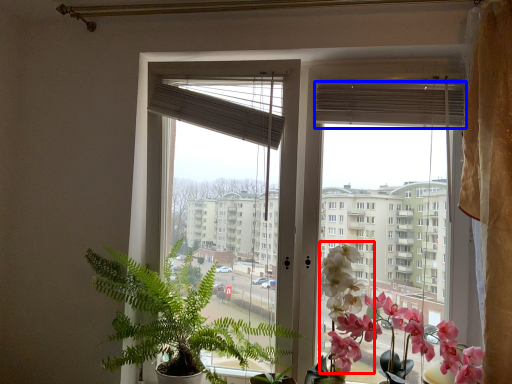
Question: Which object appears closest to the camera in this image, flower (highlighted by a red box) or blind (highlighted by a blue box)?

Choices:
 (A) flower
 (B) blind

Answer: (A)